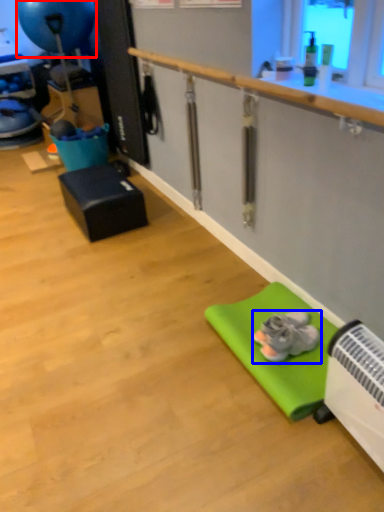
Question: Among these objects, which one is farthest to the camera, balloon (highlighted by a red box) or footwear (highlighted by a blue box)?

Choices:
 (A) balloon
 (B) footwear

Answer: (A)